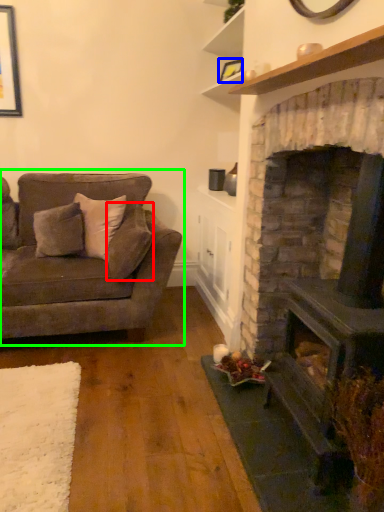
Question: Which object is the closest to the pillow (highlighted by a red box)? Choose among these: picture frame (highlighted by a blue box) or studio couch (highlighted by a green box).

Choices:
 (A) picture frame
 (B) studio couch

Answer: (B)